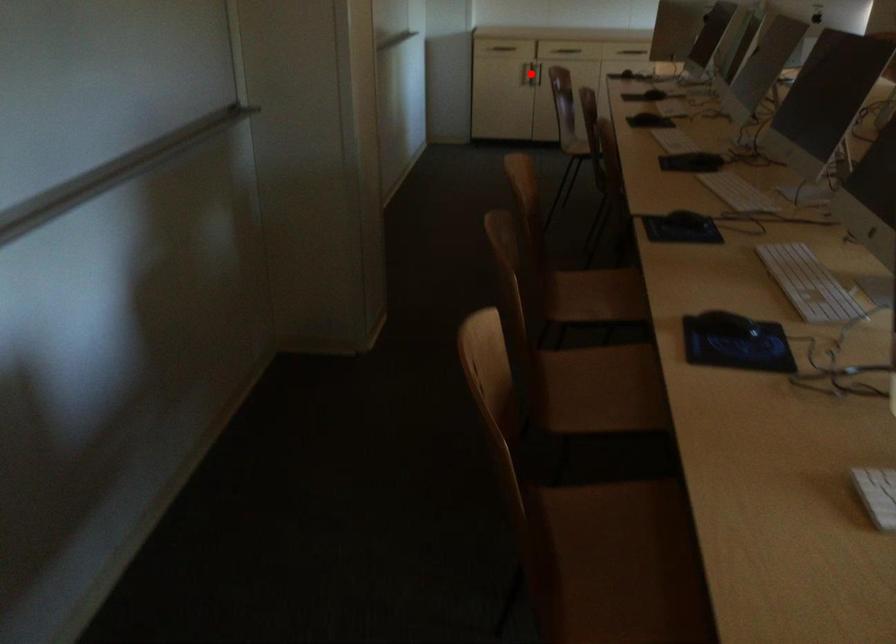
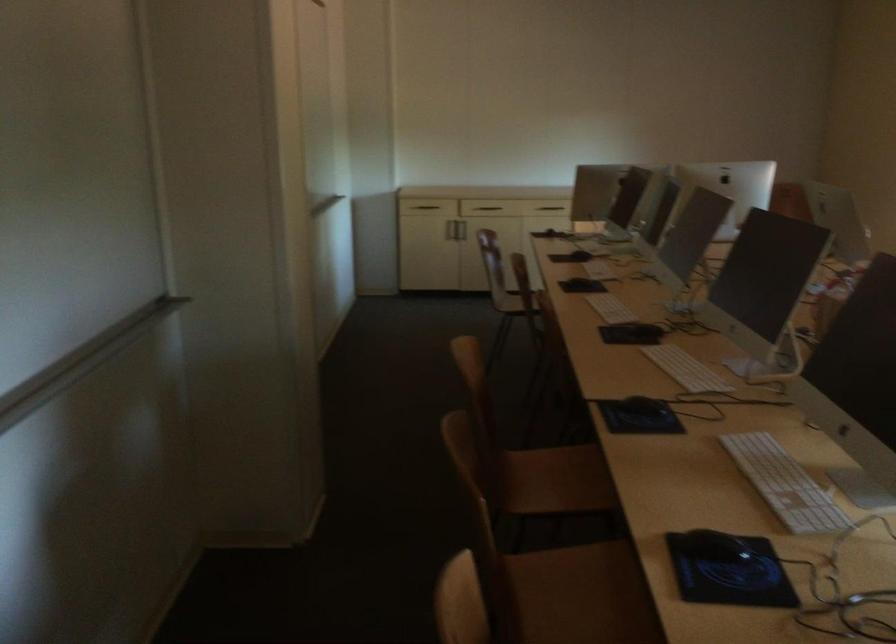
Where in the second image is the point corresponding to the highlighted location from the first image?

(454, 230)